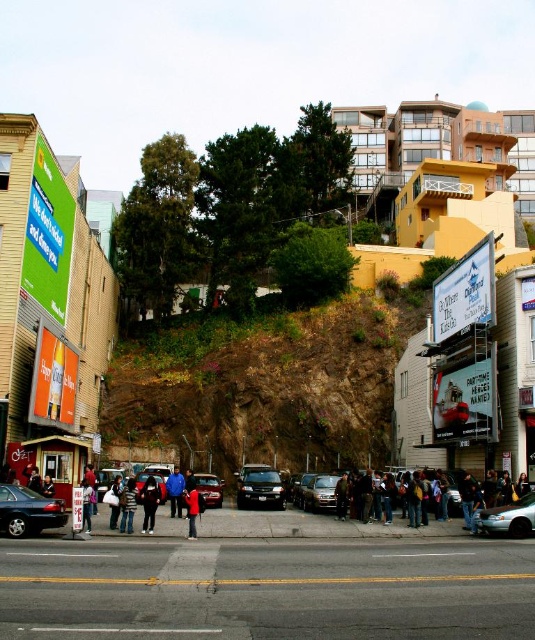
Looking at this image, you are a photographer standing on the sidewalk and want to take a photo of both the dark blue jeans at lower left and the dark blue shirt at center. Which object should you focus on first to ensure both are in sharp focus?

You should focus on the dark blue shirt at center first because the dark blue jeans at lower left is closer to the viewer, so adjusting focus from the closer object to the farther one will help both be in sharp focus.

You are a delivery person carrying a large package that requires placing on top of the satin black suv at center. Can you determine if the dark brown leather jacket at center can be placed there without being crushed by the package?

The satin black suv at center is taller than the dark brown leather jacket at center, so placing the package on top of the satin black suv at center would not crush the dark brown leather jacket at center as it is shorter.

From the picture: You are a delivery person who needs to place a package exactly at the coordinates mentioned in the scene. The package must be placed where the dark brown leather jacket at center is located. What are the coordinates where you should place the package?

The coordinates for placing the package should be at point (453, 493), which is where the dark brown leather jacket at center is located.